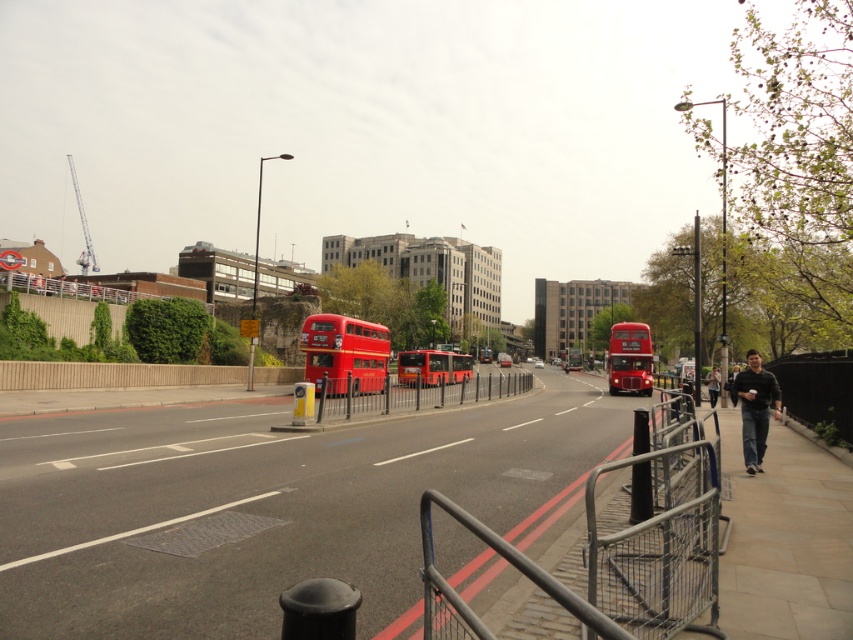
Which of these two, matte red double-decker bus at center-left or matte red bus at center, stands shorter?

matte red bus at center is shorter.

At what (x,y) coordinates should I click in order to perform the action: click on matte red double-decker bus at center-left. Please return your answer as a coordinate pair (x, y). Image resolution: width=853 pixels, height=640 pixels. Looking at the image, I should click on 344,353.

Which is behind, point (355, 346) or point (747, 472)?

The point (355, 346) is behind.

Does point (318, 392) lie behind point (775, 392)?

That is True.

What are the coordinates of `matte red double-decker bus at center-left` in the screenshot? It's located at 344,353.

Measure the distance between dark gray jeans at right and matte red double-decker bus at center.

dark gray jeans at right and matte red double-decker bus at center are 15.90 meters apart from each other.

The image size is (853, 640). Describe the element at coordinates (755, 408) in the screenshot. I see `dark gray jeans at right` at that location.

Where is `dark gray jeans at right`? The width and height of the screenshot is (853, 640). dark gray jeans at right is located at coordinates (755, 408).